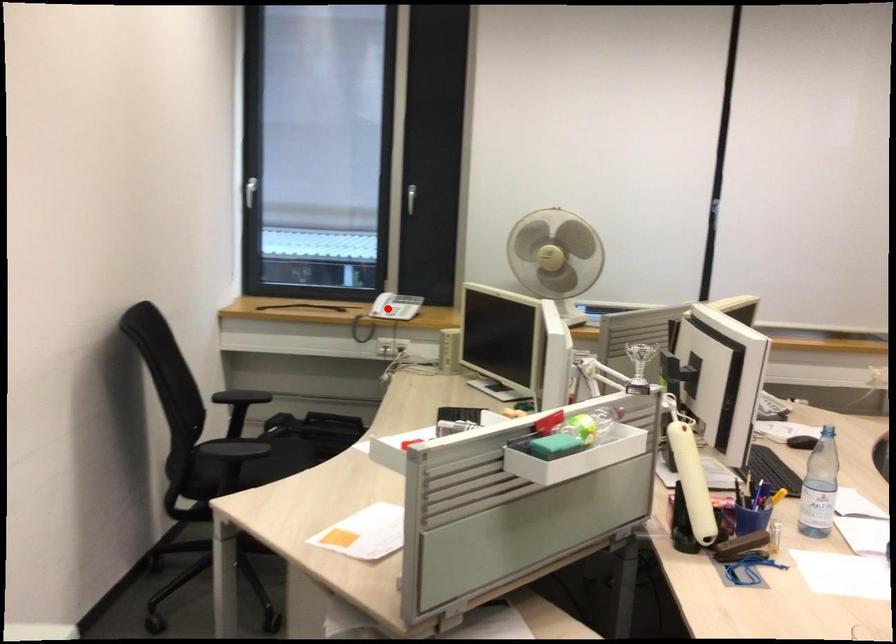
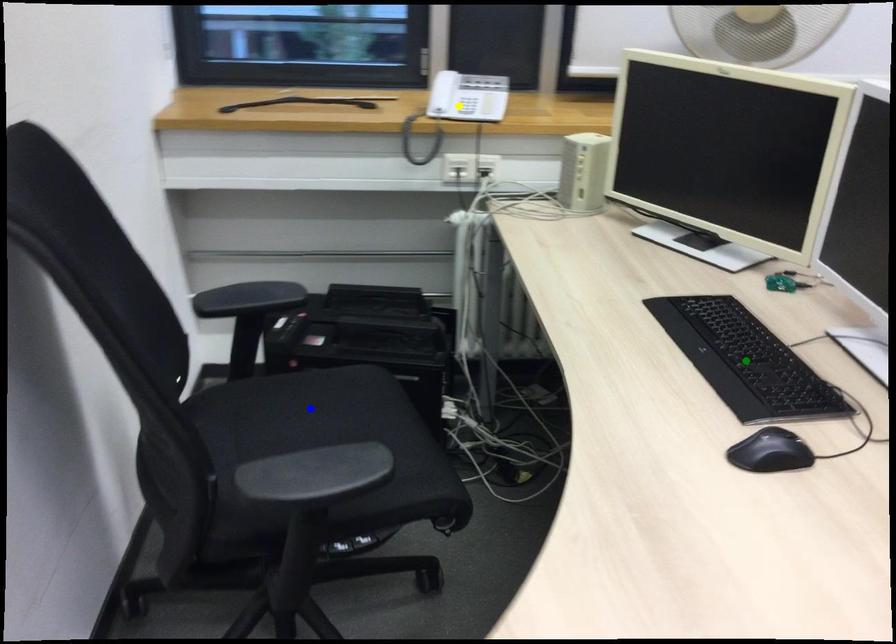
Question: I am providing you with two images of the same scene from different viewpoints. A red point is marked on the first image. You are given multiple points on the second image. Can you choose the point in image 2 that corresponds to the point in image 1?

Choices:
 (A) green point
 (B) yellow point
 (C) blue point

Answer: (B)